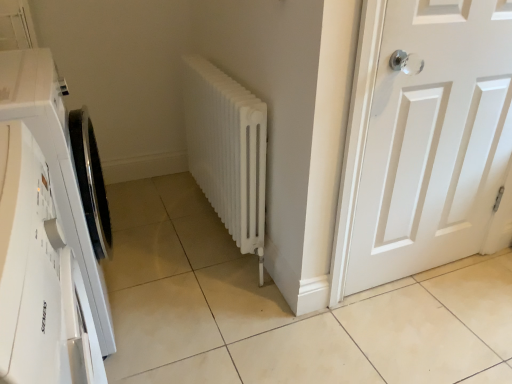
In order to click on vacant space to the left of white matte radiator at center in this screenshot , I will do `click(164, 233)`.